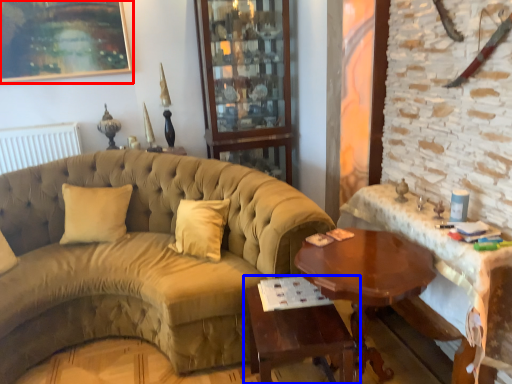
Question: Which point is closer to the camera, picture frame (highlighted by a red box) or table (highlighted by a blue box)?

Choices:
 (A) picture frame
 (B) table

Answer: (B)